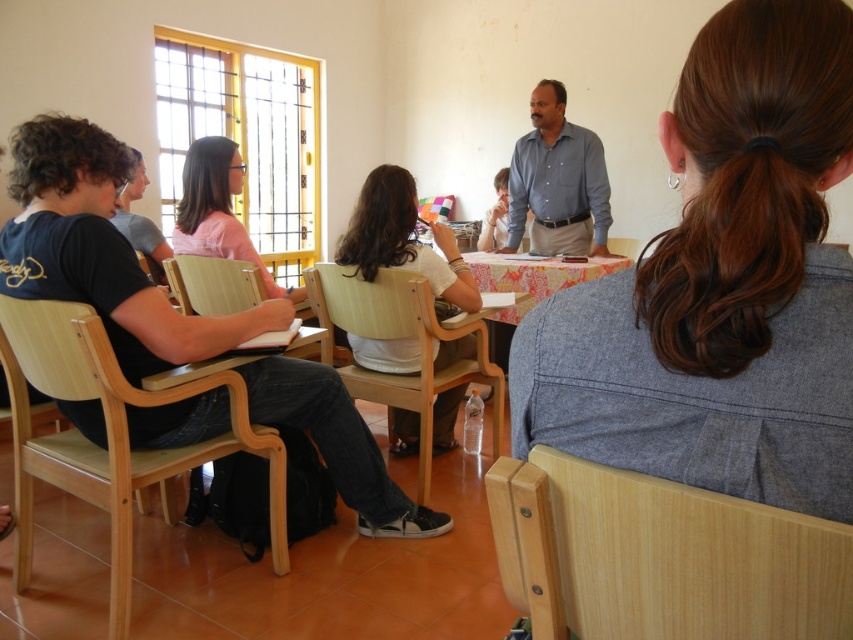
You are standing in the classroom and want to move from point A to point B. Point A is at coordinate point point [13,445] and point B is at coordinate point point [554,184]. Which point is closer to you when you first enter the classroom?

Point point [13,445] is closer to the viewer than point point [554,184], so point point [13,445] is closer when you first enter the classroom.

You are standing at the entrance of the classroom and want to sit down. There is a light wood chair at lower right located at point (660,557). Can you walk directly to this chair without needing to move around any obstacles?

The light wood chair at lower right is at point (660,557). Since the scene describes a classroom with chairs in the foreground arranged facing the front, it is likely that the path to the chair is clear of obstacles, so yes, you can walk directly to the light wood chair at lower right.

You are standing in the classroom and want to take a photo of the point at coordinates (276, 548). The camera you are using has a maximum focus range of 2 meters. Will the camera be able to focus on the point?

The point at coordinates (276, 548) is 2.11 meters from the camera, which exceeds the camera maximum focus range of 2 meters. Therefore, the camera will not be able to focus on the point.